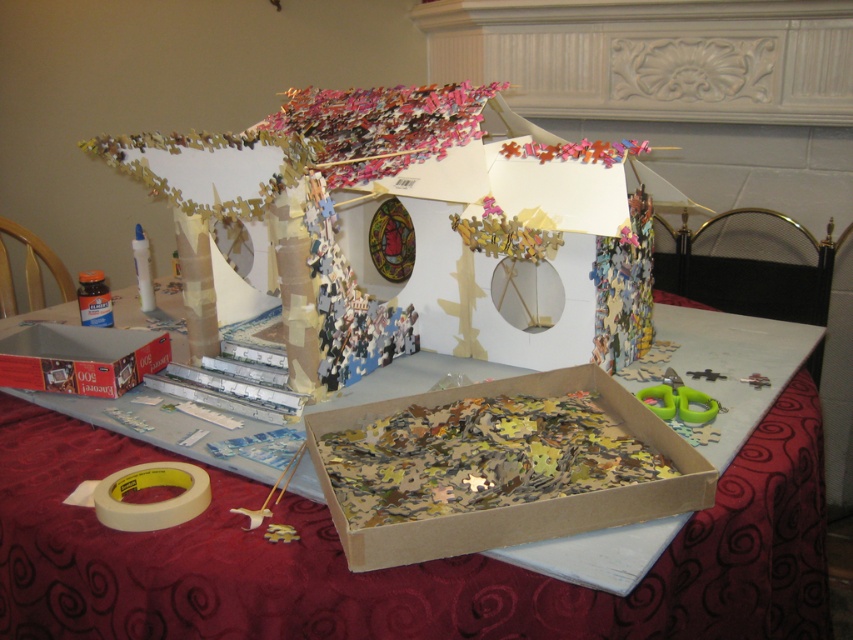
Question: Can you confirm if wooden puzzle pieces at center is thinner than cardboard puzzle pieces at center?

Choices:
 (A) no
 (B) yes

Answer: (A)

Question: Is wooden puzzle pieces at center smaller than cardboard puzzle pieces at center?

Choices:
 (A) no
 (B) yes

Answer: (A)

Question: Considering the relative positions of cardboard puzzle pieces at center and metallic cardboard box at lower left in the image provided, where is cardboard puzzle pieces at center located with respect to metallic cardboard box at lower left?

Choices:
 (A) above
 (B) below

Answer: (B)

Question: Considering the real-world distances, which object is closest to the metallic cardboard box at lower left?

Choices:
 (A) cardboard puzzle pieces at center
 (B) wooden puzzle pieces at center

Answer: (B)

Question: Which of the following is the closest to the observer?

Choices:
 (A) (329, 497)
 (B) (374, 595)
 (C) (91, 394)

Answer: (B)

Question: Which of the following is the closest to the observer?

Choices:
 (A) (68, 326)
 (B) (106, 456)

Answer: (B)